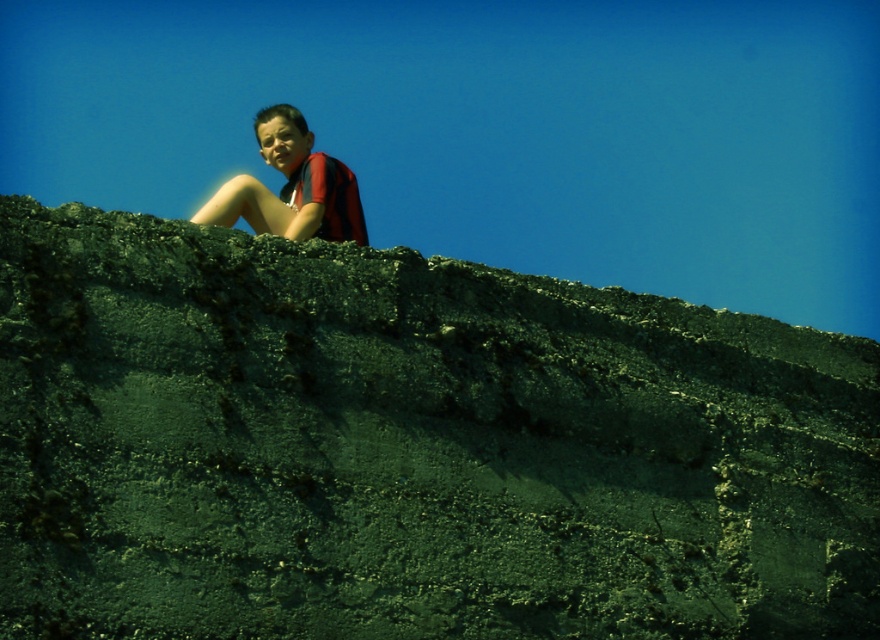
Based on the photo, you are standing at the base of a mountain and see the dark gray textured rock at upper center. If you want to reach it, would you need to climb upwards or downwards?

The dark gray textured rock at upper center is located at upper center, so you would need to climb upwards to reach it.

You are a photographer trying to capture a portrait of the person wearing the matte red shirt at upper center. To ensure the dark gray textured rock at upper center does not block the background, which object should be positioned closer to the camera?

The dark gray textured rock at upper center is shorter than the matte red shirt at upper center, so positioning the matte red shirt at upper center closer to the camera will ensure the rock does not block the background.